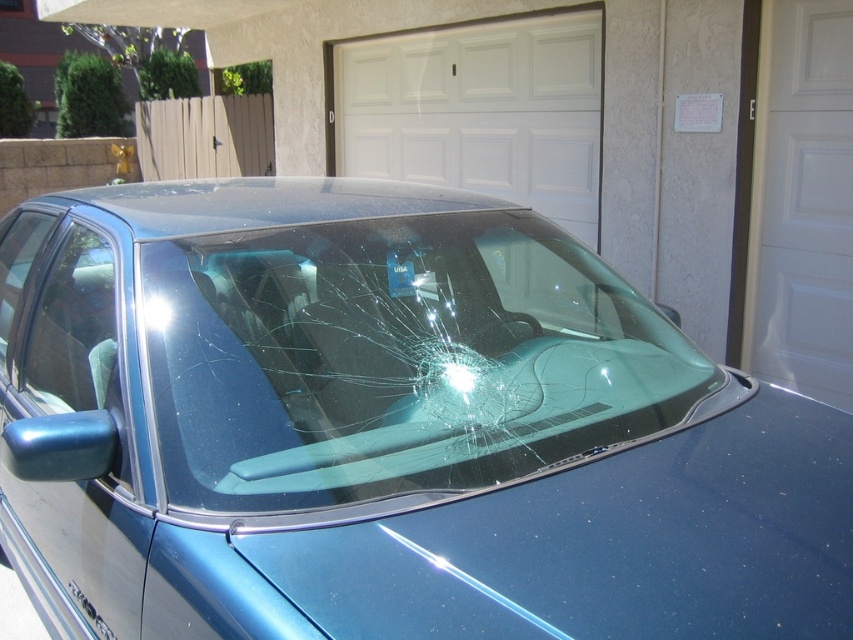
Can you confirm if white smooth garage door at center is thinner than transparent glass window at center?

Incorrect, white smooth garage door at center's width is not less than transparent glass window at center's.

Who is shorter, white smooth garage door at center or transparent glass window at center?

Standing shorter between the two is transparent glass window at center.

Describe the element at coordinates (480, 109) in the screenshot. This screenshot has height=640, width=853. I see `white smooth garage door at center` at that location.

The height and width of the screenshot is (640, 853). What are the coordinates of `white smooth garage door at center` in the screenshot? It's located at (480, 109).

Can you confirm if glossy blue car at center is positioned to the right of white smooth garage door at center?

Incorrect, glossy blue car at center is not on the right side of white smooth garage door at center.

Is glossy blue car at center bigger than white smooth garage door at center?

Incorrect, glossy blue car at center is not larger than white smooth garage door at center.

What do you see at coordinates (387, 429) in the screenshot?
I see `glossy blue car at center` at bounding box center [387, 429].

Find the location of a particular element. The image size is (853, 640). glossy blue car at center is located at coordinates (387, 429).

Does white smooth garage door at center appear on the left side of white smooth door at right?

Correct, you'll find white smooth garage door at center to the left of white smooth door at right.

Consider the image. Between white smooth garage door at center and white smooth door at right, which one has less height?

Standing shorter between the two is white smooth garage door at center.

Which is in front, point (584, 20) or point (793, 188)?

Point (793, 188)

Identify the location of white smooth garage door at center. This screenshot has height=640, width=853. (x=480, y=109).